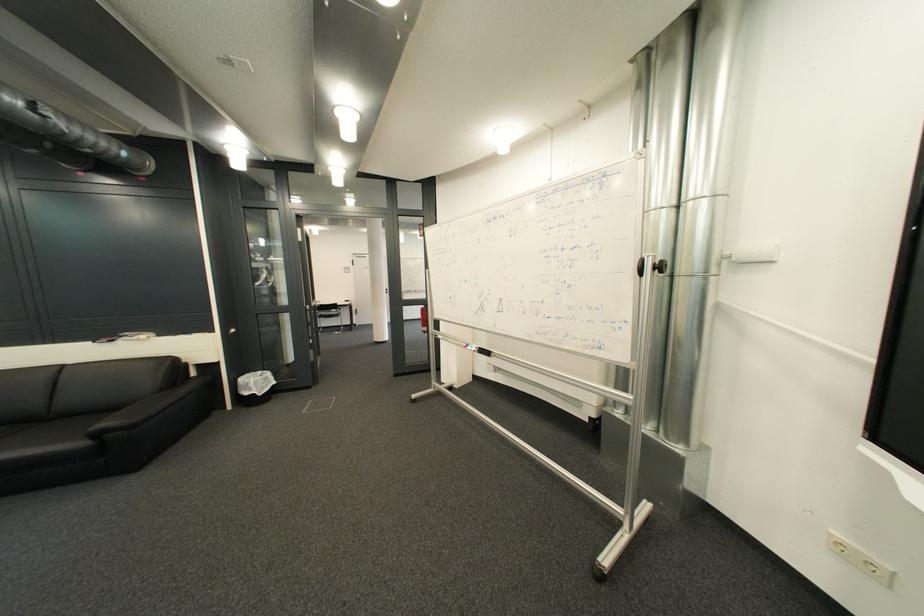
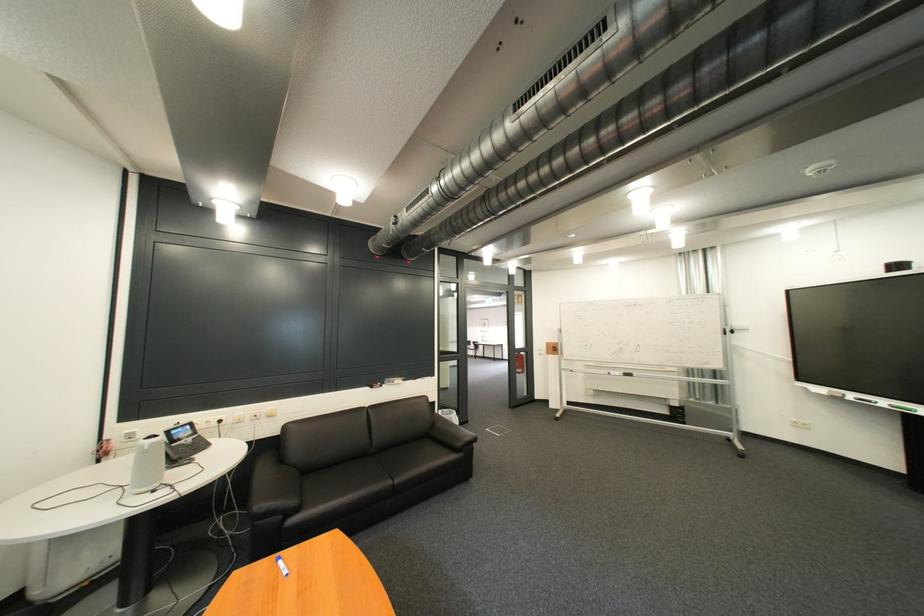
Question: The images are taken continuously from a first-person perspective. In which direction are you moving?

Choices:
 (A) Left
 (B) Right
 (C) Forward
 (D) Backward

Answer: (A)